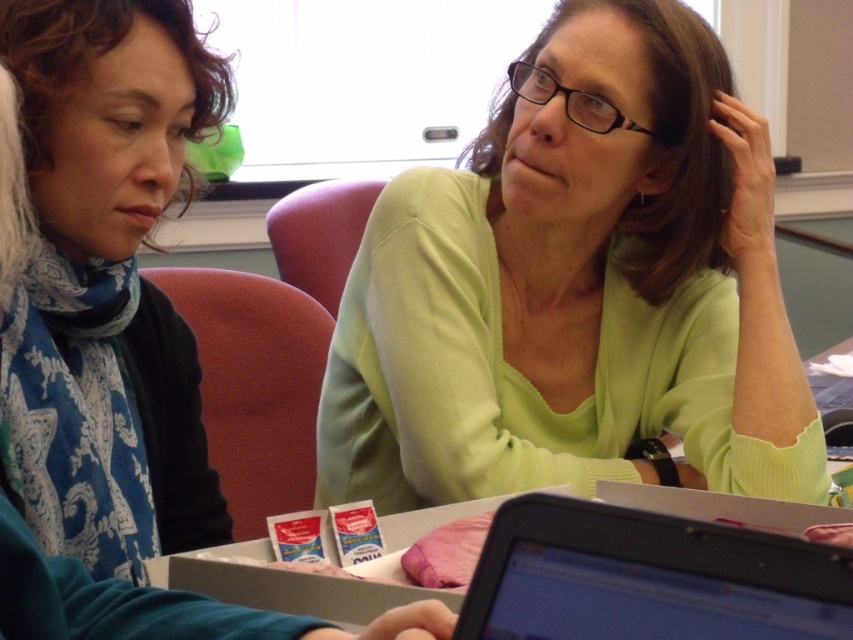
Question: Which point is closer to the camera?

Choices:
 (A) black plastic laptop at lower center
 (B) green matte sweater at center

Answer: (A)

Question: Which point is closer to the camera?

Choices:
 (A) black plastic laptop at lower center
 (B) matte green sweater at center
 (C) green matte sweater at center

Answer: (A)

Question: Which of these objects is positioned closest to the black plastic laptop at lower center?

Choices:
 (A) matte green sweater at center
 (B) green matte sweater at center

Answer: (A)

Question: Can you confirm if green matte sweater at center is positioned to the right of matte green sweater at center?

Choices:
 (A) no
 (B) yes

Answer: (B)

Question: Does matte green sweater at center have a greater width compared to black plastic laptop at lower center?

Choices:
 (A) no
 (B) yes

Answer: (B)

Question: Is green matte sweater at center thinner than black plastic laptop at lower center?

Choices:
 (A) no
 (B) yes

Answer: (A)